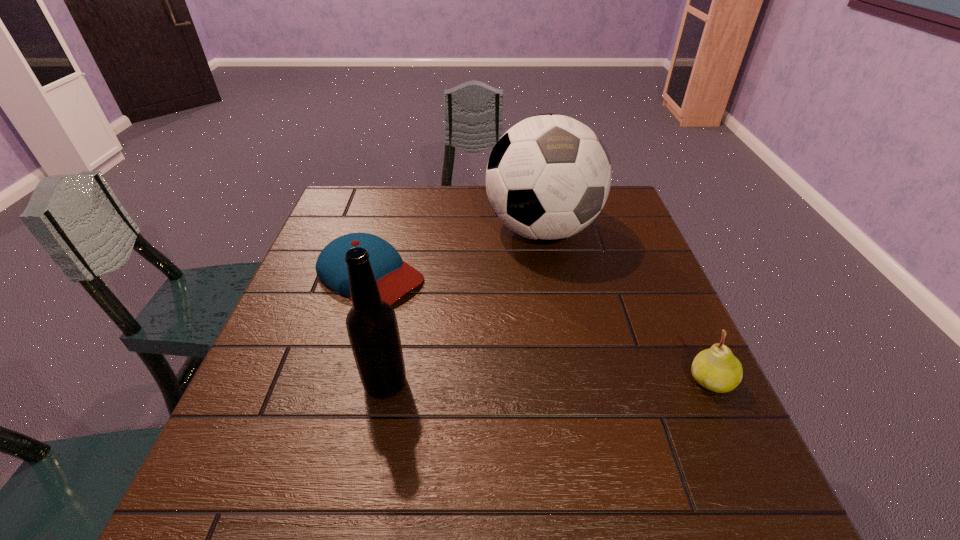
You are a GUI agent. You are given a task and a screenshot of the screen. Output one action in this format:
    pyautogui.click(x=<x>, y=<y>)
    Task: Click on the vacant space that satisfies the following two spatial constraints: 1. on the front side of the beer bottle; 2. on the left side of the baseball cap
    
    Given the screenshot: What is the action you would take?
    pyautogui.click(x=339, y=383)